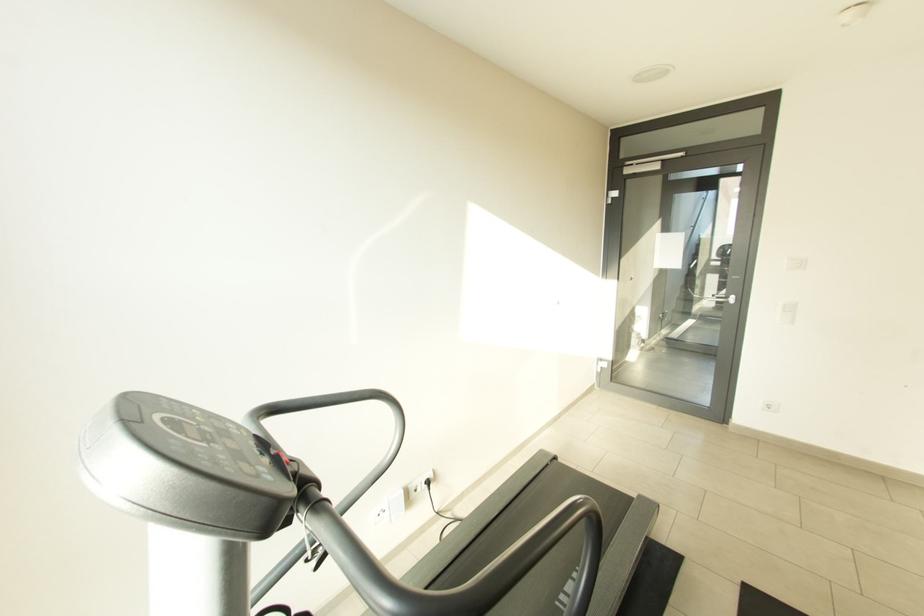
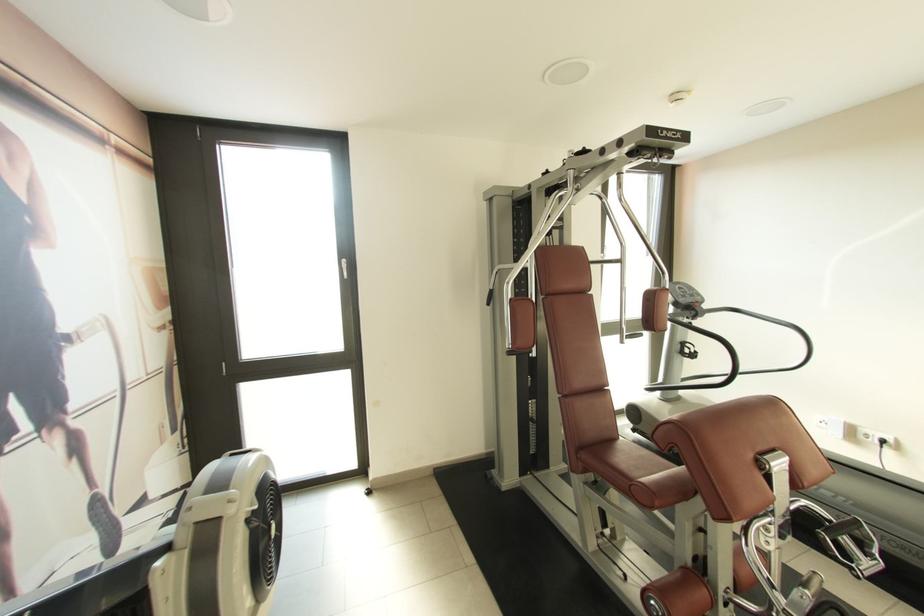
In the second image, find the point that corresponds to the point at 417,488 in the first image.

(868, 432)